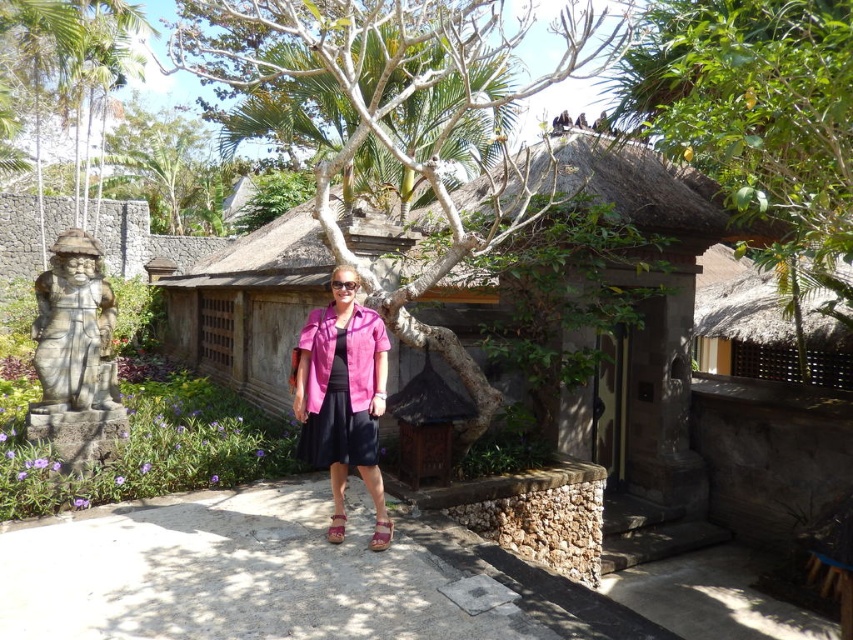
Question: Can you confirm if pink matte shirt at center is positioned to the left of stone statue at left?

Choices:
 (A) no
 (B) yes

Answer: (A)

Question: Among these objects, which one is farthest from the camera?

Choices:
 (A) brown thatch hut at center
 (B) green leafy tree at upper left

Answer: (B)

Question: Considering the real-world distances, which object is farthest from the stone statue at left?

Choices:
 (A) pink matte shirt at center
 (B) green leafy tree at upper right
 (C) green leafy tree at upper left
 (D) bare wood tree at center

Answer: (C)

Question: Is pink matte shirt at center above green leafy tree at upper left?

Choices:
 (A) no
 (B) yes

Answer: (A)

Question: Among these objects, which one is farthest from the camera?

Choices:
 (A) brown thatch hut at center
 (B) pink matte shirt at center

Answer: (A)

Question: Considering the relative positions of brown thatch hut at center and green leafy tree at upper left in the image provided, where is brown thatch hut at center located with respect to green leafy tree at upper left?

Choices:
 (A) above
 (B) below

Answer: (B)